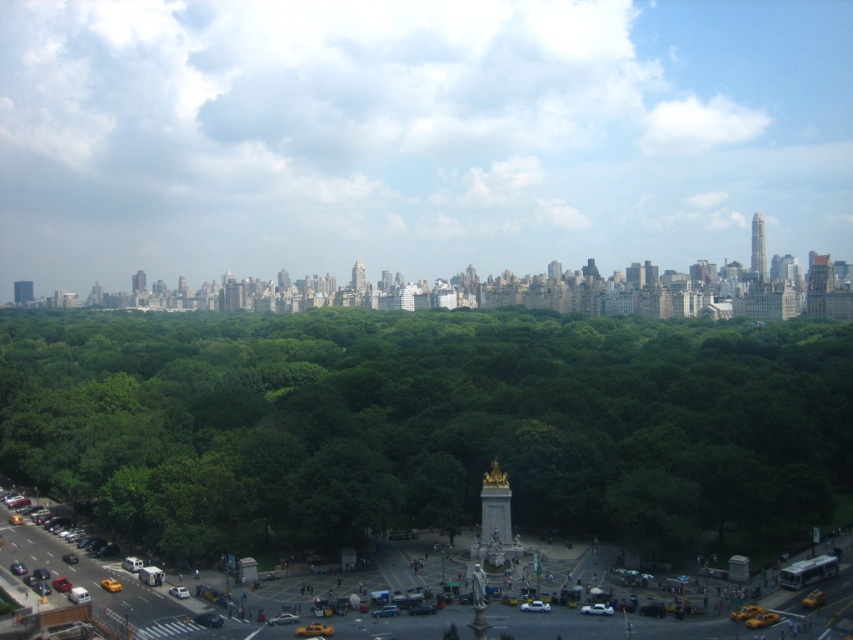
Which of these two, green leafy trees at center or green glass tower at upper left, stands shorter?

green glass tower at upper left

Is green leafy trees at center to the right of green glass tower at upper left from the viewer's perspective?

Yes, green leafy trees at center is to the right of green glass tower at upper left.

Describe the element at coordinates (427, 424) in the screenshot. I see `green leafy trees at center` at that location.

Locate an element on the screen. The image size is (853, 640). green leafy trees at center is located at coordinates (427, 424).

The image size is (853, 640). What are the coordinates of `green leafy trees at center` in the screenshot? It's located at (427, 424).

Which is behind, point (682, 333) or point (358, 264)?

The point (358, 264) is more distant.

Is point (672, 465) positioned before point (361, 262)?

Yes, point (672, 465) is closer to viewer.

Locate an element on the screen. green leafy trees at center is located at coordinates (427, 424).

Measure the distance between gold metallic skyscraper at upper right and camera.

gold metallic skyscraper at upper right is 565.13 meters from camera.

Describe the element at coordinates (758, 248) in the screenshot. I see `gold metallic skyscraper at upper right` at that location.

The image size is (853, 640). I want to click on gold metallic skyscraper at upper right, so 758,248.